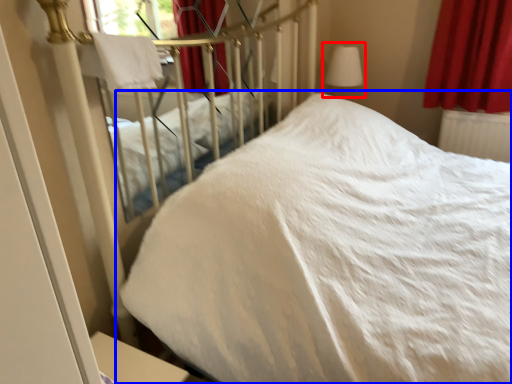
Question: Which of the following is the closest to the observer, table lamp (highlighted by a red box) or bed (highlighted by a blue box)?

Choices:
 (A) table lamp
 (B) bed

Answer: (B)